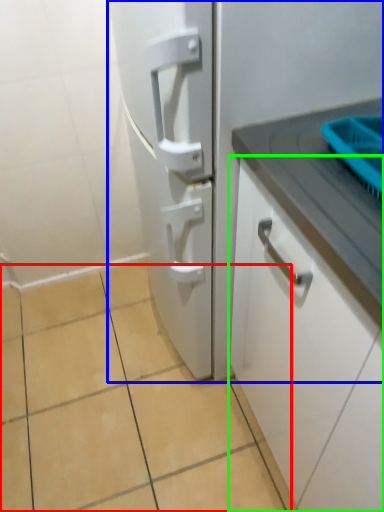
Question: Based on their relative distances, which object is nearer to ceramic tile (highlighted by a red box)? Choose from refrigerator (highlighted by a blue box) and cabinetry (highlighted by a green box).

Choices:
 (A) refrigerator
 (B) cabinetry

Answer: (A)